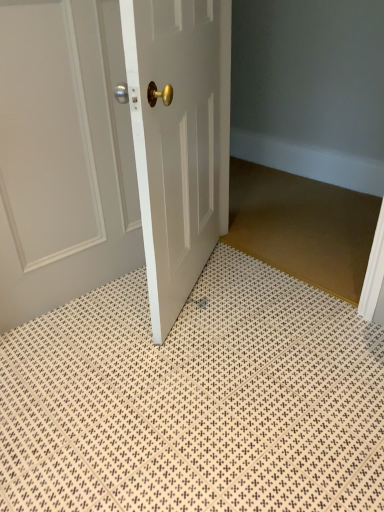
The width and height of the screenshot is (384, 512). What do you see at coordinates (179, 139) in the screenshot?
I see `white glossy door at center, which is the first door in right-to-left order` at bounding box center [179, 139].

What do you see at coordinates (195, 401) in the screenshot? I see `white textured bath mat at center` at bounding box center [195, 401].

What are the coordinates of `brown textured mat at center` in the screenshot? It's located at (302, 227).

I want to click on white glossy door at center, the 2th door in the left-to-right sequence, so click(x=179, y=139).

How different are the orientations of brown textured mat at center and white glossy door at center, which is the first door in right-to-left order, in degrees?

The angular difference between brown textured mat at center and white glossy door at center, which is the first door in right-to-left order, is 119 degrees.

In the image, is brown textured mat at center positioned in front of or behind white glossy door at center, the 2th door in the left-to-right sequence?

In the image, brown textured mat at center appears behind white glossy door at center, the 2th door in the left-to-right sequence.

Which is more to the right, brown textured mat at center or white glossy door at center, the 2th door in the left-to-right sequence?

Positioned to the right is brown textured mat at center.

Which point is more distant from viewer, (363, 199) or (153, 11)?

Point (363, 199)

From a real-world perspective, is brown textured mat at center beneath white glossy door at upper left, placed as the first door when sorted from left to right?

Correct, in the physical world, brown textured mat at center is lower than white glossy door at upper left, placed as the first door when sorted from left to right.

Considering their positions, is brown textured mat at center located in front of or behind white glossy door at upper left, placed as the first door when sorted from left to right?

brown textured mat at center is behind white glossy door at upper left, placed as the first door when sorted from left to right.

Considering the relative sizes of brown textured mat at center and white glossy door at upper left, which ranks as the second door in right-to-left order, in the image provided, is brown textured mat at center thinner than white glossy door at upper left, which ranks as the second door in right-to-left order,?

No.

From the image's perspective, which object appears higher, brown textured mat at center or white glossy door at upper left, which ranks as the second door in right-to-left order?

white glossy door at upper left, which ranks as the second door in right-to-left order, appears higher in the image.

Which is more distant, (96,261) or (233,234)?

Point (233,234)

In the scene shown: Which of these two, white glossy door at upper left, which ranks as the second door in right-to-left order, or brown textured mat at center, is smaller?

Smaller between the two is brown textured mat at center.

Between white glossy door at upper left, placed as the first door when sorted from left to right, and brown textured mat at center, which one is positioned in front?

white glossy door at upper left, placed as the first door when sorted from left to right, is closer to the camera.

Could you tell me if white glossy door at upper left, which ranks as the second door in right-to-left order, is turned towards brown textured mat at center?

No, white glossy door at upper left, which ranks as the second door in right-to-left order, does not turn towards brown textured mat at center.

You are a GUI agent. You are given a task and a screenshot of the screen. Output one action in this format:
    pyautogui.click(x=<x>, y=<y>)
    Task: Click on the door on the left side of white glossy door at center, which is the first door in right-to-left order
    This screenshot has height=512, width=384.
    Given the screenshot: What is the action you would take?
    pyautogui.click(x=63, y=156)

In terms of height, does white glossy door at upper left, which ranks as the second door in right-to-left order, look taller or shorter compared to white glossy door at center, the 2th door in the left-to-right sequence?

In the image, white glossy door at upper left, which ranks as the second door in right-to-left order, appears to be taller than white glossy door at center, the 2th door in the left-to-right sequence.

Considering the relative positions of white glossy door at upper left, placed as the first door when sorted from left to right, and white glossy door at center, the 2th door in the left-to-right sequence, in the image provided, is white glossy door at upper left, placed as the first door when sorted from left to right, to the left or to the right of white glossy door at center, the 2th door in the left-to-right sequence,?

In the image, white glossy door at upper left, placed as the first door when sorted from left to right, appears on the left side of white glossy door at center, the 2th door in the left-to-right sequence.

From a real-world perspective, relative to brown textured mat at center, is white textured bath mat at center vertically above or below?

In terms of real-world spatial position, white textured bath mat at center is below brown textured mat at center.

Would you say white textured bath mat at center is inside or outside brown textured mat at center?

white textured bath mat at center exists outside the volume of brown textured mat at center.

Could you tell me if white textured bath mat at center is turned towards brown textured mat at center?

Yes, white textured bath mat at center is aimed at brown textured mat at center.

Considering the relative sizes of white textured bath mat at center and brown textured mat at center in the image provided, is white textured bath mat at center smaller than brown textured mat at center?

No.

From the image's perspective, is white glossy door at center, which is the first door in right-to-left order, above or below white textured bath mat at center?

white glossy door at center, which is the first door in right-to-left order, is situated higher than white textured bath mat at center in the image.

Is white glossy door at center, the 2th door in the left-to-right sequence, facing away from white textured bath mat at center?

No.

What's the angular difference between white glossy door at center, which is the first door in right-to-left order, and white textured bath mat at center's facing directions?

61.3 degrees separate the facing orientations of white glossy door at center, which is the first door in right-to-left order, and white textured bath mat at center.

Which of these two, white glossy door at center, which is the first door in right-to-left order, or white textured bath mat at center, is bigger?

With larger size is white glossy door at center, which is the first door in right-to-left order.

Could you tell me if white glossy door at center, the 2th door in the left-to-right sequence, is facing white glossy door at upper left, placed as the first door when sorted from left to right?

Yes, white glossy door at center, the 2th door in the left-to-right sequence, is oriented towards white glossy door at upper left, placed as the first door when sorted from left to right.

From a real-world perspective, is white glossy door at center, the 2th door in the left-to-right sequence, above or below white glossy door at upper left, which ranks as the second door in right-to-left order?

From a real-world perspective, white glossy door at center, the 2th door in the left-to-right sequence, is physically above white glossy door at upper left, which ranks as the second door in right-to-left order.

Do you think white glossy door at center, which is the first door in right-to-left order, is within white glossy door at upper left, which ranks as the second door in right-to-left order, or outside of it?

white glossy door at center, which is the first door in right-to-left order, is spatially situated outside white glossy door at upper left, which ranks as the second door in right-to-left order.

You are a GUI agent. You are given a task and a screenshot of the screen. Output one action in this format:
    pyautogui.click(x=<x>, y=<y>)
    Task: Click on the doormat behind the white glossy door at center, the 2th door in the left-to-right sequence
    This screenshot has height=512, width=384.
    Given the screenshot: What is the action you would take?
    coord(302,227)

Where is `door that is the 1st one when counting forward from the brown textured mat at center`? Image resolution: width=384 pixels, height=512 pixels. door that is the 1st one when counting forward from the brown textured mat at center is located at coordinates (63, 156).

When comparing their distances from brown textured mat at center, does white glossy door at center, the 2th door in the left-to-right sequence, or white textured bath mat at center seem further?

white textured bath mat at center.

Looking at the image, which one is located closer to brown textured mat at center, white glossy door at upper left, which ranks as the second door in right-to-left order, or white glossy door at center, the 2th door in the left-to-right sequence?

The object closer to brown textured mat at center is white glossy door at center, the 2th door in the left-to-right sequence.

Consider the image. From the image, which object appears to be farther from white glossy door at center, which is the first door in right-to-left order, white textured bath mat at center or brown textured mat at center?

Based on the image, brown textured mat at center appears to be further to white glossy door at center, which is the first door in right-to-left order.

Considering their positions, is white textured bath mat at center positioned closer to brown textured mat at center than white glossy door at upper left, which ranks as the second door in right-to-left order?

white textured bath mat at center lies closer to brown textured mat at center than the other object.

From the image, which object appears to be farther from white glossy door at upper left, which ranks as the second door in right-to-left order, white glossy door at center, the 2th door in the left-to-right sequence, or white textured bath mat at center?

white textured bath mat at center lies further to white glossy door at upper left, which ranks as the second door in right-to-left order, than the other object.

When comparing their distances from white glossy door at upper left, which ranks as the second door in right-to-left order, does brown textured mat at center or white glossy door at center, the 2th door in the left-to-right sequence, seem further?

The object further to white glossy door at upper left, which ranks as the second door in right-to-left order, is brown textured mat at center.

When comparing their distances from white textured bath mat at center, does brown textured mat at center or white glossy door at center, which is the first door in right-to-left order, seem further?

brown textured mat at center lies further to white textured bath mat at center than the other object.

Based on their spatial positions, is white textured bath mat at center or brown textured mat at center further from white glossy door at upper left, which ranks as the second door in right-to-left order?

brown textured mat at center lies further to white glossy door at upper left, which ranks as the second door in right-to-left order, than the other object.

This screenshot has height=512, width=384. Find the location of `bath mat between white glossy door at upper left, placed as the first door when sorted from left to right, and brown textured mat at center from left to right`. bath mat between white glossy door at upper left, placed as the first door when sorted from left to right, and brown textured mat at center from left to right is located at coordinates (195, 401).

The width and height of the screenshot is (384, 512). Find the location of `door located between white glossy door at upper left, placed as the first door when sorted from left to right, and brown textured mat at center in the left-right direction`. door located between white glossy door at upper left, placed as the first door when sorted from left to right, and brown textured mat at center in the left-right direction is located at coordinates (179, 139).

You are a GUI agent. You are given a task and a screenshot of the screen. Output one action in this format:
    pyautogui.click(x=<x>, y=<y>)
    Task: Click on the door between white glossy door at center, the 2th door in the left-to-right sequence, and white textured bath mat at center in the up-down direction
    This screenshot has width=384, height=512.
    Given the screenshot: What is the action you would take?
    pyautogui.click(x=63, y=156)